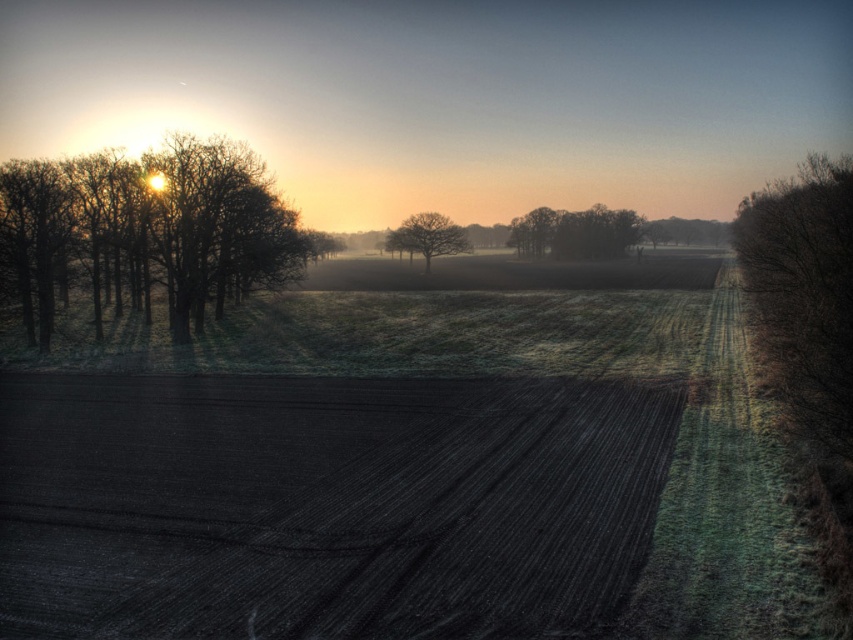
You are standing in the middle of the field and see the brown matte trees at left and the brown matte tree at right. Which group of trees is closer to your left side?

The brown matte trees at left are closer to your left side because they are positioned to the left of the brown matte tree at right.

You are a farmer who wants to plant new saplings. You have two areas in your field where you can plant them. One area is near the brown matte trees at left and the other is near the dark green textured trees at center. Considering the size of the trees, which area would provide more shade for the saplings?

The area near the brown matte trees at left would provide more shade for the saplings because the brown matte trees at left is bigger than the dark green textured trees at center.

You are standing in the field and looking towards the horizon. Which object, the brown matte trees at left or the smooth brown tree at center, is closer to the horizon?

The smooth brown tree at center is closer to the horizon because the brown matte trees at left are located above it, meaning they are closer to the viewer.